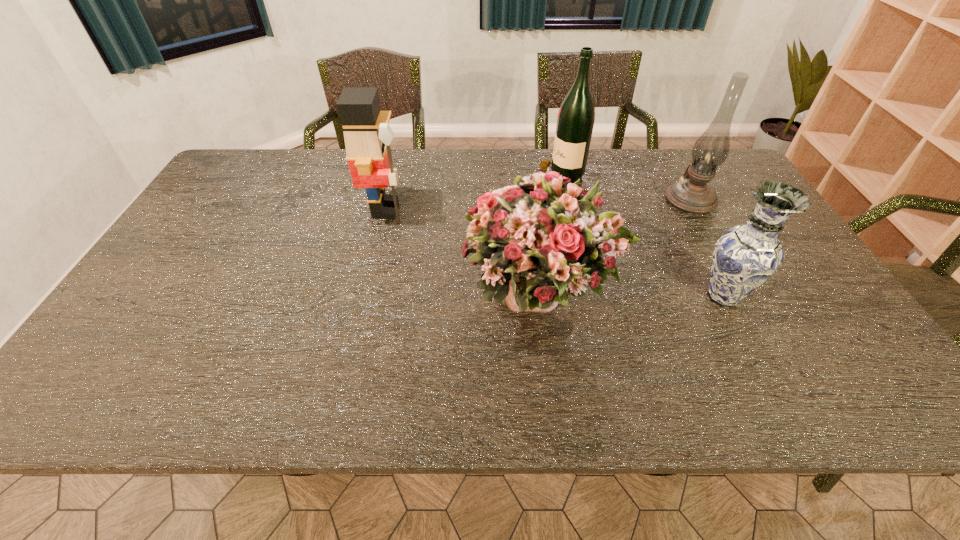
Find the location of a particular element. wine bottle is located at coordinates (575, 122).

Identify the location of oil lamp. (693, 194).

The image size is (960, 540). Find the location of `the leftmost object`. the leftmost object is located at coordinates (367, 134).

Where is `bouquet`? This screenshot has height=540, width=960. bouquet is located at coordinates (539, 241).

Where is `vase`? This screenshot has width=960, height=540. vase is located at coordinates (745, 256).

You are a GUI agent. You are given a task and a screenshot of the screen. Output one action in this format:
    pyautogui.click(x=<x>, y=<y>)
    Task: Click on the free location located on the surface of the wine bottle
    The width and height of the screenshot is (960, 540).
    Given the screenshot: What is the action you would take?
    pyautogui.click(x=456, y=177)

You are a GUI agent. You are given a task and a screenshot of the screen. Output one action in this format:
    pyautogui.click(x=<x>, y=<y>)
    Task: Click on the free region located 0.240m on the surface of the wine bottle
    
    Given the screenshot: What is the action you would take?
    pyautogui.click(x=463, y=177)

At what (x,y) coordinates should I click in order to perform the action: click on blank area located 0.400m on the surface of the wine bottle. Please return your answer as a coordinate pair (x, y). Looking at the image, I should click on (413, 177).

Where is `vacant point located on the left of the oil lamp`? vacant point located on the left of the oil lamp is located at coordinates (566, 200).

Where is `vacant space located 0.370m in front of the nutcracker holding the staff`? The image size is (960, 540). vacant space located 0.370m in front of the nutcracker holding the staff is located at coordinates (534, 210).